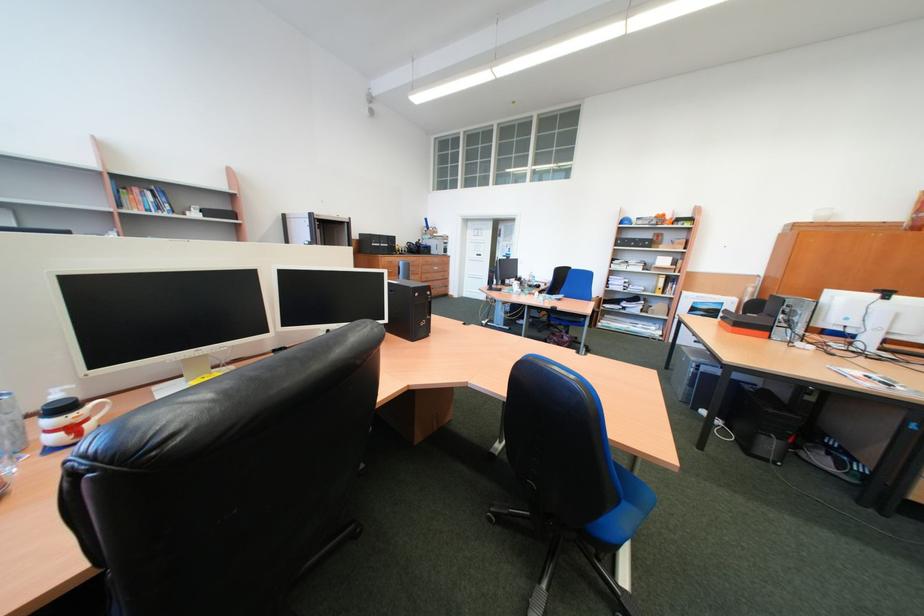
The width and height of the screenshot is (924, 616). In order to click on dark drawer handle in this screenshot , I will do `click(421, 272)`.